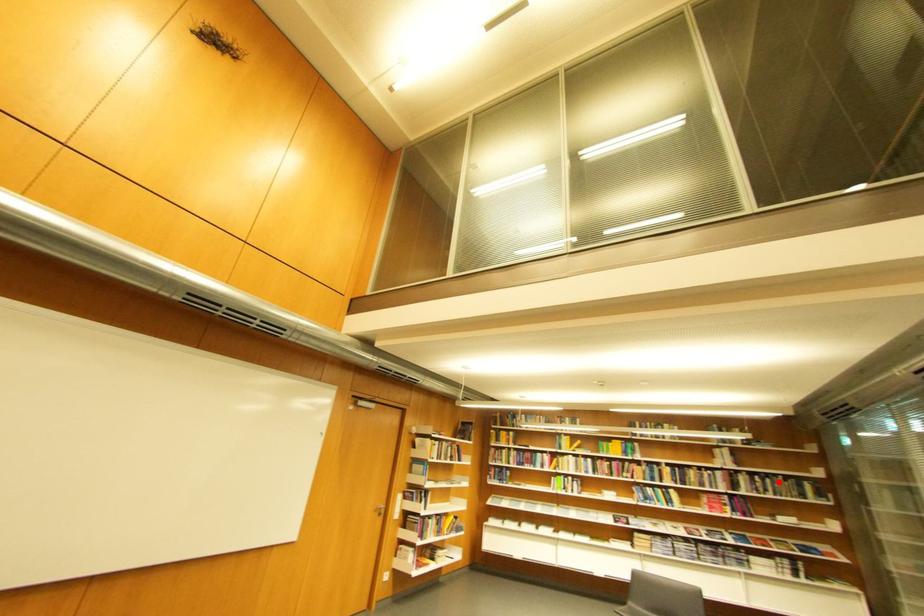
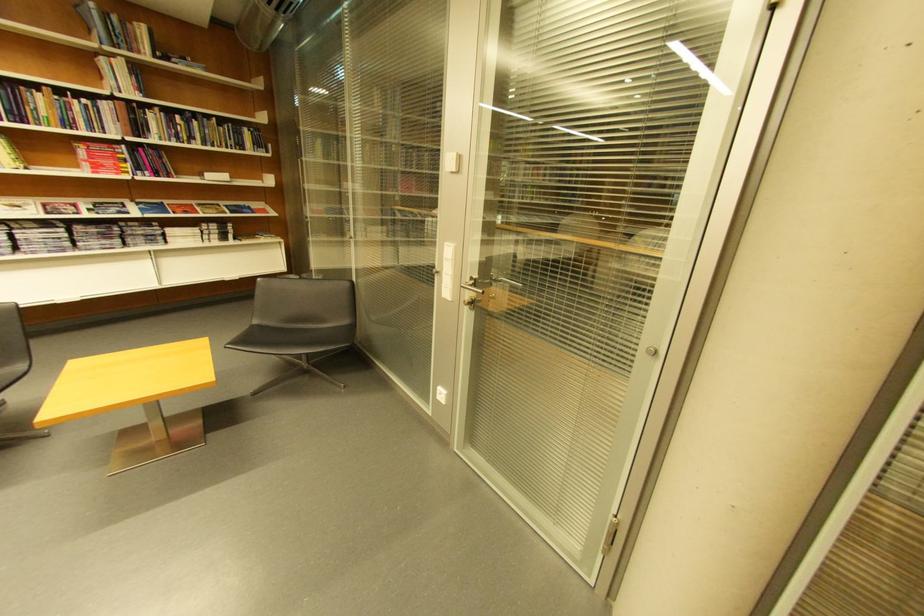
The point at the highlighted location is marked in the first image. Where is the corresponding point in the second image?

(205, 124)